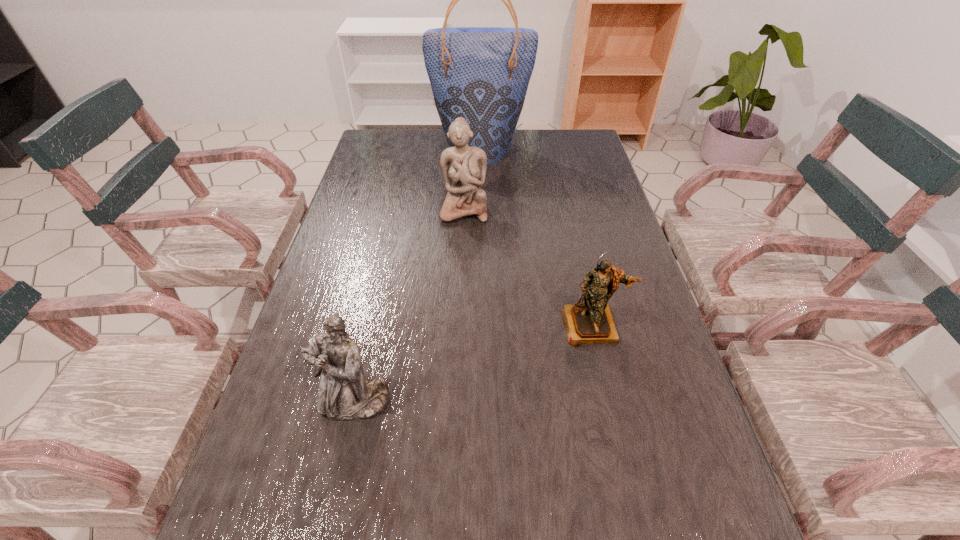
The height and width of the screenshot is (540, 960). I want to click on blank region between the second nearest figurine and the farthest figurine, so click(x=528, y=268).

You are a GUI agent. You are given a task and a screenshot of the screen. Output one action in this format:
    pyautogui.click(x=<x>, y=<y>)
    Task: Click on the free spot between the second nearest figurine and the second farthest object
    This screenshot has width=960, height=540.
    Given the screenshot: What is the action you would take?
    pyautogui.click(x=528, y=268)

Find the location of `unoccupied position between the second nearest object and the leftmost object`. unoccupied position between the second nearest object and the leftmost object is located at coordinates (473, 364).

The image size is (960, 540). I want to click on free space between the third nearest object and the rightmost object, so click(528, 268).

At what (x,y) coordinates should I click in order to perform the action: click on empty space that is in between the tallest object and the rightmost object. Please return your answer as a coordinate pair (x, y). Image resolution: width=960 pixels, height=540 pixels. Looking at the image, I should click on (537, 238).

The image size is (960, 540). Find the location of `blank region between the leftmost object and the third nearest object`. blank region between the leftmost object and the third nearest object is located at coordinates (409, 306).

Find the location of a particular element. Image resolution: width=960 pixels, height=540 pixels. vacant area between the second farthest figurine and the farthest figurine is located at coordinates (528, 268).

The height and width of the screenshot is (540, 960). In order to click on blank region between the leftmost figurine and the shopping bag in this screenshot , I will do `click(418, 276)`.

Choose which object is the second nearest neighbor to the second figurine from left to right. Please provide its 2D coordinates. Your answer should be formatted as a tuple, i.e. [(x, y)], where the tuple contains the x and y coordinates of a point satisfying the conditions above.

[(590, 321)]

The image size is (960, 540). Identify the location of object that is the closest to the third farthest object. (464, 167).